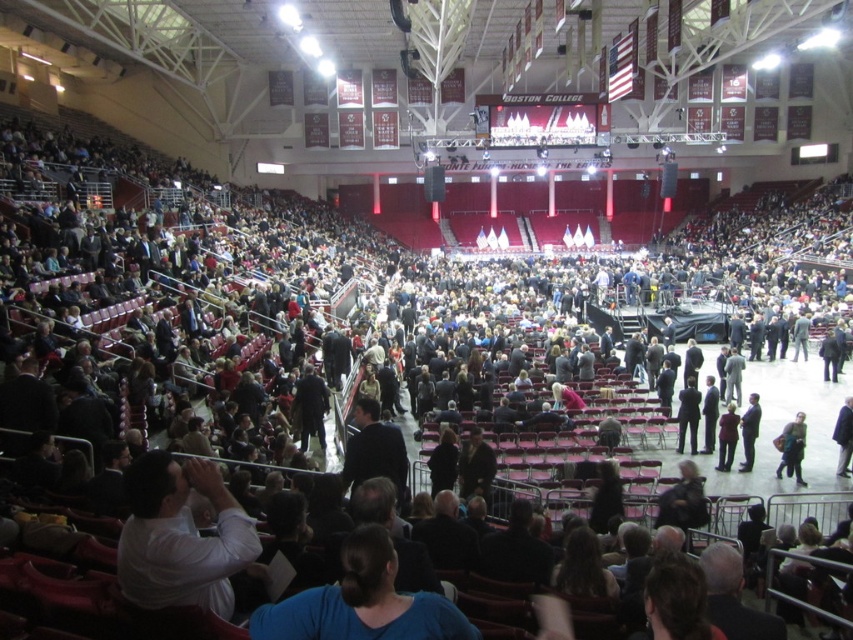
Does point (149, 461) come farther from viewer compared to point (780, 442)?

No, (149, 461) is in front of (780, 442).

Measure the distance between white shirt at lower left and dark gray fabric jacket at lower right.

A distance of 25.93 meters exists between white shirt at lower left and dark gray fabric jacket at lower right.

Who is more forward, (x=212, y=500) or (x=775, y=474)?

Point (x=212, y=500) is in front.

Locate an element on the screen. The image size is (853, 640). white shirt at lower left is located at coordinates (180, 536).